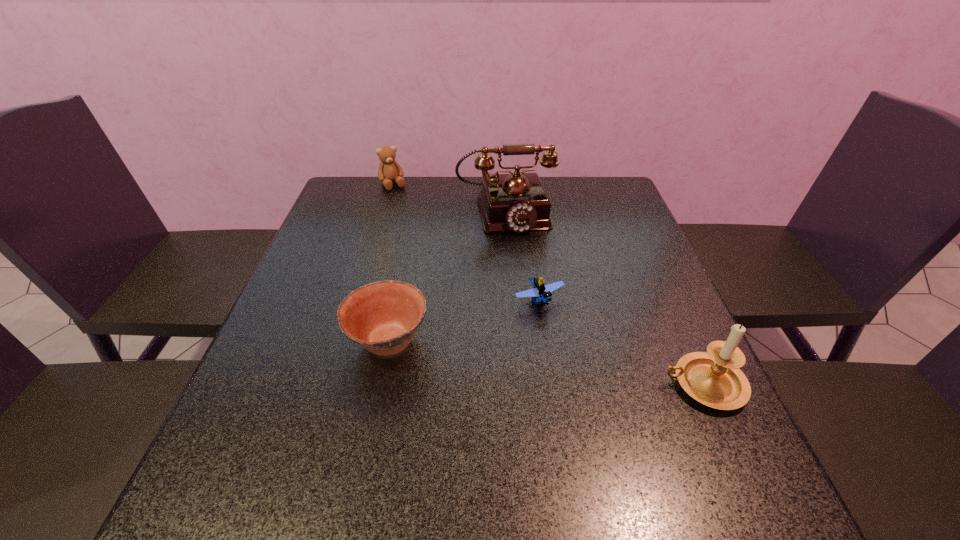
The height and width of the screenshot is (540, 960). Find the location of `object that is the third closest to the second shortest object`. object that is the third closest to the second shortest object is located at coordinates (713, 378).

This screenshot has height=540, width=960. What are the coordinates of `object that ranks as the closest to the rightmost object` in the screenshot? It's located at (542, 292).

You are a GUI agent. You are given a task and a screenshot of the screen. Output one action in this format:
    pyautogui.click(x=<x>, y=<y>)
    Task: Click on the free region that satisfies the following two spatial constraints: 1. on the front side of the teddy bear; 2. on the right side of the telephone
    The height and width of the screenshot is (540, 960).
    Given the screenshot: What is the action you would take?
    pyautogui.click(x=385, y=212)